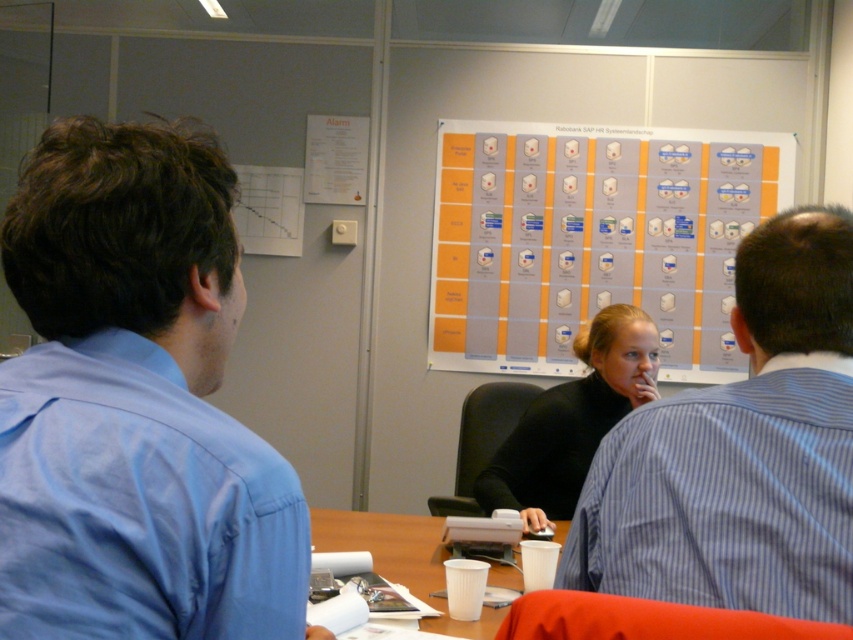
Question: Which point is closer to the camera?

Choices:
 (A) blue shirt at left
 (B) white paper cup at center
 (C) blue striped shirt at upper right
 (D) white paper at upper left

Answer: (A)

Question: From the image, what is the correct spatial relationship of blue shirt at left in relation to orange matte poster at center?

Choices:
 (A) below
 (B) above

Answer: (A)

Question: Which object appears closest to the camera in this image?

Choices:
 (A) orange matte poster at center
 (B) white paper cup at center
 (C) black matte turtleneck at center

Answer: (B)

Question: Which object appears closest to the camera in this image?

Choices:
 (A) black matte turtleneck at center
 (B) white paper at upper left

Answer: (A)

Question: From the image, what is the correct spatial relationship of blue striped shirt at upper right in relation to white paper at upper left?

Choices:
 (A) above
 (B) below

Answer: (B)

Question: Can you confirm if blue shirt at left is thinner than orange matte poster at center?

Choices:
 (A) yes
 (B) no

Answer: (A)